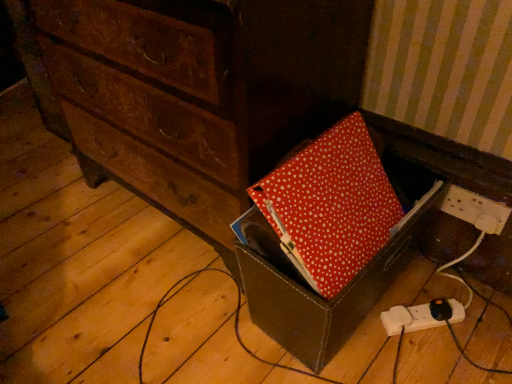
Where is `white plastic socket at lower right`? The image size is (512, 384). white plastic socket at lower right is located at coordinates (476, 210).

Describe the element at coordinates (476, 210) in the screenshot. I see `white plastic socket at lower right` at that location.

Where is `white plastic socket at lower right`? Image resolution: width=512 pixels, height=384 pixels. white plastic socket at lower right is located at coordinates (476, 210).